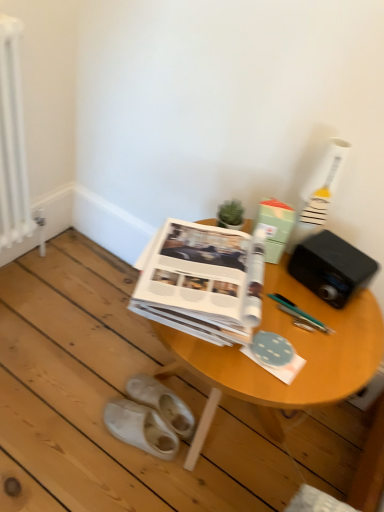
At what (x,y) coordinates should I click in order to perform the action: click on black plastic speaker at upper right. Please return your answer as a coordinate pair (x, y). Looking at the image, I should click on (331, 267).

The width and height of the screenshot is (384, 512). Find the location of `green matte paper at center, the second paperback book positioned from the left`. green matte paper at center, the second paperback book positioned from the left is located at coordinates (274, 227).

This screenshot has width=384, height=512. In order to click on white metallic radiator at left in this screenshot , I will do (14, 145).

What is the approximate height of white suede slippers at lower left, acting as the second footwear starting from the front?

white suede slippers at lower left, acting as the second footwear starting from the front, is 3.85 inches in height.

What do you see at coordinates (162, 403) in the screenshot? The width and height of the screenshot is (384, 512). I see `white suede slippers at lower left, which is the 1th footwear from back to front` at bounding box center [162, 403].

The image size is (384, 512). I want to click on white fabric slippers at lower left, the 2th footwear when ordered from back to front, so click(140, 428).

Between green matte paper at center, the first paperback book from the right, and black plastic speaker at upper right, which one has smaller width?

Thinner between the two is green matte paper at center, the first paperback book from the right.

Relative to black plastic speaker at upper right, is green matte paper at center, the second paperback book positioned from the left, in front or behind?

green matte paper at center, the second paperback book positioned from the left, is behind black plastic speaker at upper right.

Is black plastic speaker at upper right a part of green matte paper at center, the first paperback book from the right?

That's incorrect, black plastic speaker at upper right is not inside green matte paper at center, the first paperback book from the right.

Which is nearer, (266, 215) or (356, 251)?

Clearly, point (266, 215) is closer to the camera than point (356, 251).

Is point (9, 16) positioned behind point (168, 420)?

No, (9, 16) is in front of (168, 420).

Considering the sizes of objects white metallic radiator at left and white suede slippers at lower left, which is the 1th footwear from back to front, in the image provided, who is bigger, white metallic radiator at left or white suede slippers at lower left, which is the 1th footwear from back to front,?

white metallic radiator at left.

Does white metallic radiator at left touch white suede slippers at lower left, which is the 1th footwear from back to front?

There is a gap between white metallic radiator at left and white suede slippers at lower left, which is the 1th footwear from back to front.

Relative to white suede slippers at lower left, acting as the second footwear starting from the front, is white metallic radiator at left in front or behind?

Visually, white metallic radiator at left is located in front of white suede slippers at lower left, acting as the second footwear starting from the front.

Is white fabric slippers at lower left, the 2th footwear when ordered from back to front, beside white metallic radiator at left?

There is a gap between white fabric slippers at lower left, the 2th footwear when ordered from back to front, and white metallic radiator at left.

Based on their positions, is white fabric slippers at lower left, which is the 1th footwear in front-to-back order, located to the left or right of white metallic radiator at left?

In the image, white fabric slippers at lower left, which is the 1th footwear in front-to-back order, appears on the right side of white metallic radiator at left.

Based on the photo, is white fabric slippers at lower left, the 2th footwear when ordered from back to front, bigger than white metallic radiator at left?

Actually, white fabric slippers at lower left, the 2th footwear when ordered from back to front, might be smaller than white metallic radiator at left.

Considering the relative sizes of white paper at center, marked as the 1th paperback book in a left-to-right arrangement, and white suede slippers at lower left, which is the 1th footwear from back to front, in the image provided, is white paper at center, marked as the 1th paperback book in a left-to-right arrangement, smaller than white suede slippers at lower left, which is the 1th footwear from back to front,?

No.

From a real-world perspective, does white paper at center, marked as the 1th paperback book in a left-to-right arrangement, stand above white suede slippers at lower left, which is the 1th footwear from back to front?

Yes, from a real-world perspective, white paper at center, marked as the 1th paperback book in a left-to-right arrangement, is over white suede slippers at lower left, which is the 1th footwear from back to front

Are white paper at center, which appears as the second paperback book when viewed from the right, and white suede slippers at lower left, acting as the second footwear starting from the front, far apart?

They are positioned close to each other.

Considering the relative sizes of white paper at center, which appears as the second paperback book when viewed from the right, and white suede slippers at lower left, which is the 1th footwear from back to front, in the image provided, is white paper at center, which appears as the second paperback book when viewed from the right, taller than white suede slippers at lower left, which is the 1th footwear from back to front,?

Yes, white paper at center, which appears as the second paperback book when viewed from the right, is taller than white suede slippers at lower left, which is the 1th footwear from back to front.

Based on the photo, is the position of white fabric slippers at lower left, which is the 1th footwear in front-to-back order, more distant than that of green matte paper at center, the second paperback book positioned from the left?

Yes, white fabric slippers at lower left, which is the 1th footwear in front-to-back order, is behind green matte paper at center, the second paperback book positioned from the left.

Is white fabric slippers at lower left, the 2th footwear when ordered from back to front, oriented towards green matte paper at center, the first paperback book from the right?

No, white fabric slippers at lower left, the 2th footwear when ordered from back to front, is not facing towards green matte paper at center, the first paperback book from the right.

Does white fabric slippers at lower left, which is the 1th footwear in front-to-back order, have a greater width compared to green matte paper at center, the second paperback book positioned from the left?

Correct, the width of white fabric slippers at lower left, which is the 1th footwear in front-to-back order, exceeds that of green matte paper at center, the second paperback book positioned from the left.

Can green matte paper at center, the first paperback book from the right, be found inside white fabric slippers at lower left, the 2th footwear when ordered from back to front?

No, green matte paper at center, the first paperback book from the right, is not a part of white fabric slippers at lower left, the 2th footwear when ordered from back to front.

Considering the positions of objects white suede slippers at lower left, acting as the second footwear starting from the front, and white metallic radiator at left in the image provided, who is more to the left, white suede slippers at lower left, acting as the second footwear starting from the front, or white metallic radiator at left?

white metallic radiator at left is more to the left.

Is white suede slippers at lower left, which is the 1th footwear from back to front, facing towards white metallic radiator at left?

No, white suede slippers at lower left, which is the 1th footwear from back to front, is not oriented towards white metallic radiator at left.

Is white suede slippers at lower left, acting as the second footwear starting from the front, not within white metallic radiator at left?

Absolutely, white suede slippers at lower left, acting as the second footwear starting from the front, is external to white metallic radiator at left.

Considering the relative sizes of white fabric slippers at lower left, which is the 1th footwear in front-to-back order, and white suede slippers at lower left, acting as the second footwear starting from the front, in the image provided, is white fabric slippers at lower left, which is the 1th footwear in front-to-back order, taller than white suede slippers at lower left, acting as the second footwear starting from the front,?

No.

Is white fabric slippers at lower left, which is the 1th footwear in front-to-back order, far from white suede slippers at lower left, acting as the second footwear starting from the front?

Actually, white fabric slippers at lower left, which is the 1th footwear in front-to-back order, and white suede slippers at lower left, acting as the second footwear starting from the front, are a little close together.

Does white fabric slippers at lower left, the 2th footwear when ordered from back to front, turn towards white suede slippers at lower left, which is the 1th footwear from back to front?

No, white fabric slippers at lower left, the 2th footwear when ordered from back to front, is not facing towards white suede slippers at lower left, which is the 1th footwear from back to front.

The image size is (384, 512). I want to click on speaker in front of the green matte paper at center, the second paperback book positioned from the left, so click(331, 267).

This screenshot has width=384, height=512. There is a white metallic radiator at left. What are the coordinates of `the 1st footwear below it (from the image's perspective)` in the screenshot? It's located at (162, 403).

From the image, which object appears to be farther from black plastic speaker at upper right, wooden table at center or green matte paper at center, the first paperback book from the right?

wooden table at center.

Looking at the image, which one is located closer to green matte paper at center, the first paperback book from the right, black plastic speaker at upper right or white metallic radiator at left?

black plastic speaker at upper right lies closer to green matte paper at center, the first paperback book from the right, than the other object.

Based on their spatial positions, is white paper at center, marked as the 1th paperback book in a left-to-right arrangement, or white suede slippers at lower left, acting as the second footwear starting from the front, further from wooden table at center?

white suede slippers at lower left, acting as the second footwear starting from the front, lies further to wooden table at center than the other object.

Based on the photo, estimate the real-world distances between objects in this image. Which object is closer to white metallic radiator at left, black plastic speaker at upper right or white suede slippers at lower left, acting as the second footwear starting from the front?

Among the two, white suede slippers at lower left, acting as the second footwear starting from the front, is located nearer to white metallic radiator at left.

Considering their positions, is white suede slippers at lower left, acting as the second footwear starting from the front, positioned further to black plastic speaker at upper right than white metallic radiator at left?

white metallic radiator at left is positioned further to the anchor black plastic speaker at upper right.

Looking at the image, which one is located closer to white paper at center, which appears as the second paperback book when viewed from the right, wooden table at center or white suede slippers at lower left, acting as the second footwear starting from the front?

The object closer to white paper at center, which appears as the second paperback book when viewed from the right, is wooden table at center.

Based on their spatial positions, is white fabric slippers at lower left, the 2th footwear when ordered from back to front, or white paper at center, marked as the 1th paperback book in a left-to-right arrangement, closer to wooden table at center?

Based on the image, white paper at center, marked as the 1th paperback book in a left-to-right arrangement, appears to be nearer to wooden table at center.

Based on their spatial positions, is white metallic radiator at left or white suede slippers at lower left, acting as the second footwear starting from the front, further from white fabric slippers at lower left, which is the 1th footwear in front-to-back order?

Among the two, white metallic radiator at left is located further to white fabric slippers at lower left, which is the 1th footwear in front-to-back order.

Find the location of `table that lies between white metallic radiator at left and white fabric slippers at lower left, the 2th footwear when ordered from back to front, from top to bottom`. table that lies between white metallic radiator at left and white fabric slippers at lower left, the 2th footwear when ordered from back to front, from top to bottom is located at coordinates (296, 351).

The width and height of the screenshot is (384, 512). I want to click on speaker between green matte paper at center, the first paperback book from the right, and white suede slippers at lower left, acting as the second footwear starting from the front, in the up-down direction, so click(x=331, y=267).

At what (x,y) coordinates should I click in order to perform the action: click on paperback book between black plastic speaker at upper right and white fabric slippers at lower left, the 2th footwear when ordered from back to front, vertically. Please return your answer as a coordinate pair (x, y). Looking at the image, I should click on (200, 283).

What are the coordinates of `footwear between white metallic radiator at left and white fabric slippers at lower left, which is the 1th footwear in front-to-back order, from top to bottom` in the screenshot? It's located at (162, 403).